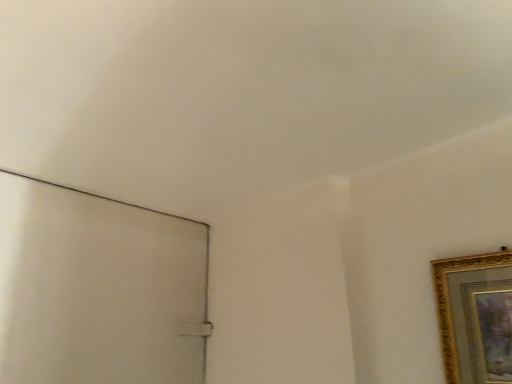
What is the approximate height of gold/gilded picture frame at upper right?

It is 11.88 inches.

What do you see at coordinates (475, 316) in the screenshot? I see `gold/gilded picture frame at upper right` at bounding box center [475, 316].

I want to click on gold/gilded picture frame at upper right, so click(475, 316).

Where is `gold/gilded picture frame at upper right`? gold/gilded picture frame at upper right is located at coordinates (475, 316).